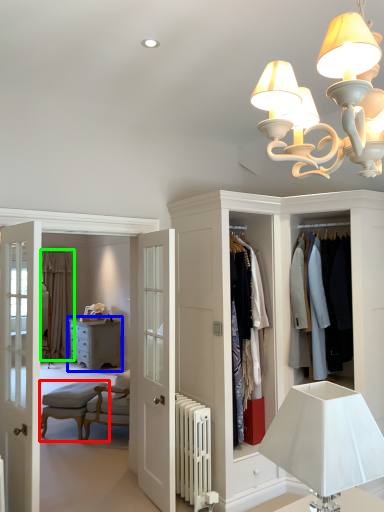
Question: Based on their relative distances, which object is farther from armchair (highlighted by a red box)? Choose from chest of drawers (highlighted by a blue box) and curtain (highlighted by a green box).

Choices:
 (A) chest of drawers
 (B) curtain

Answer: (B)